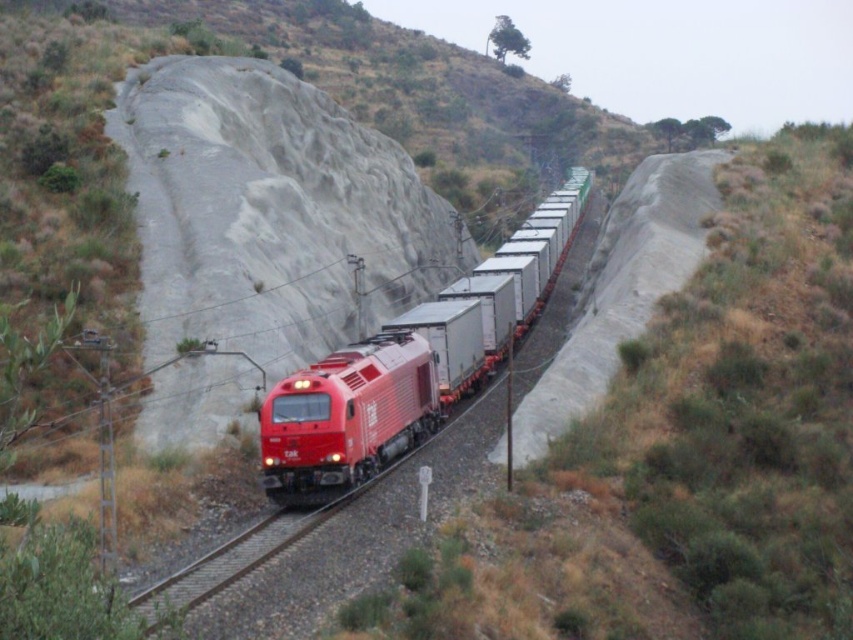
Question: Does metallic red train at center appear over metal train track at center?

Choices:
 (A) no
 (B) yes

Answer: (B)

Question: Does metallic red train at center appear over metal train track at center?

Choices:
 (A) no
 (B) yes

Answer: (B)

Question: Can you confirm if metallic red train at center is smaller than metal train track at center?

Choices:
 (A) no
 (B) yes

Answer: (A)

Question: Among these points, which one is farthest from the camera?

Choices:
 (A) (320, 509)
 (B) (335, 381)

Answer: (A)